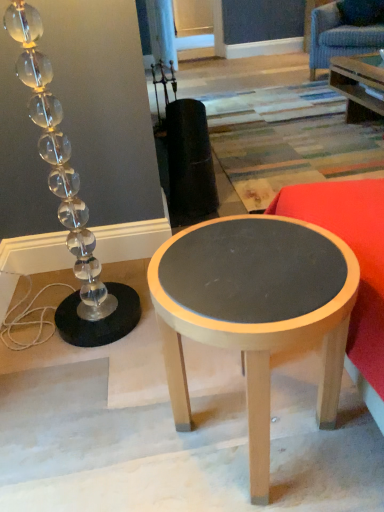
Where is `vacant space that is to the left of clear glass lamp at left`? The width and height of the screenshot is (384, 512). vacant space that is to the left of clear glass lamp at left is located at coordinates (26, 321).